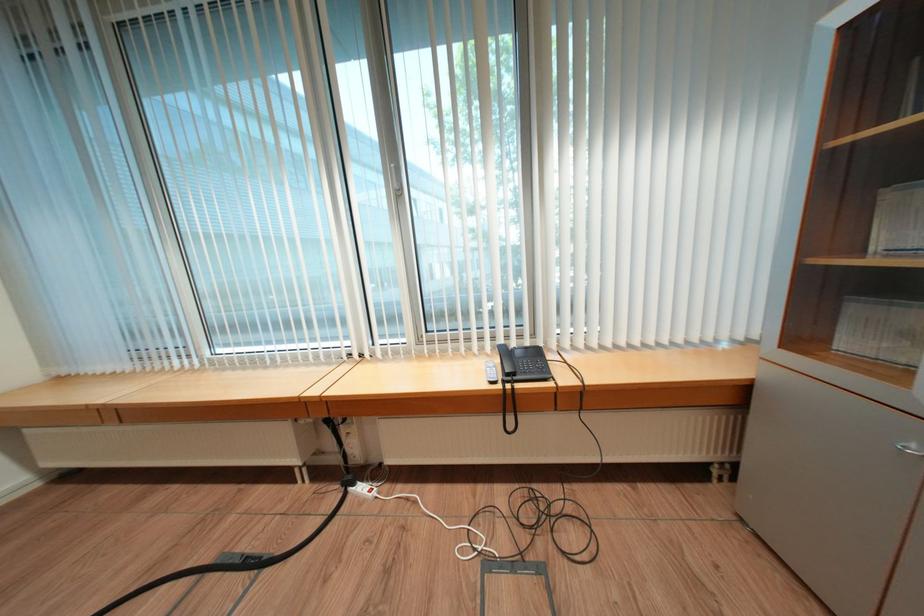
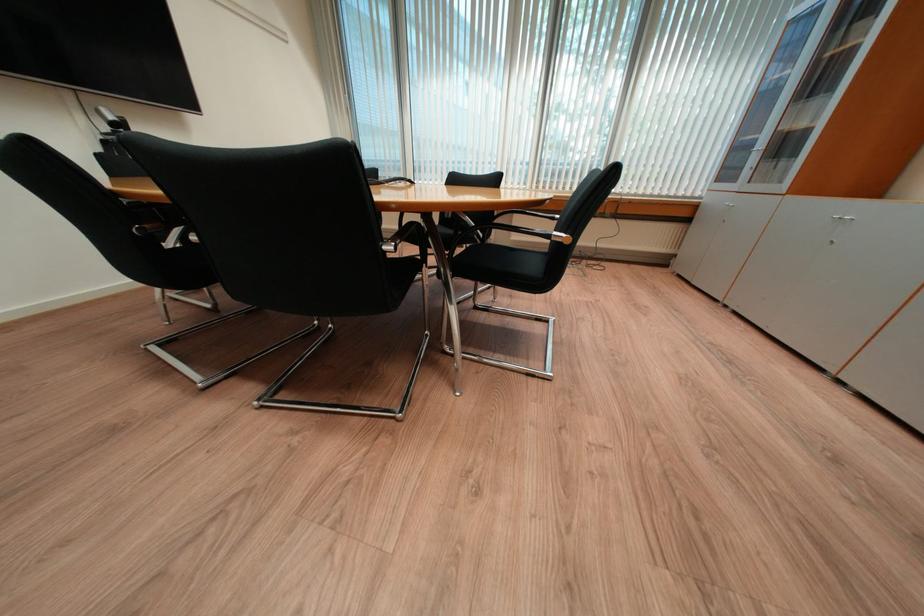
Question: What movement of the cameraman would produce the second image?

Choices:
 (A) Left
 (B) Right
 (C) Forward
 (D) Backward

Answer: (D)